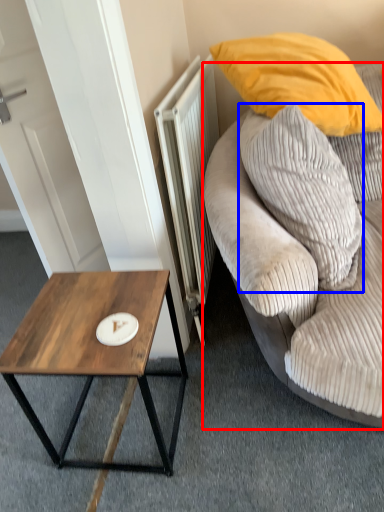
Question: Which of the following is the farthest to the observer, studio couch (highlighted by a red box) or pillow (highlighted by a blue box)?

Choices:
 (A) studio couch
 (B) pillow

Answer: (B)